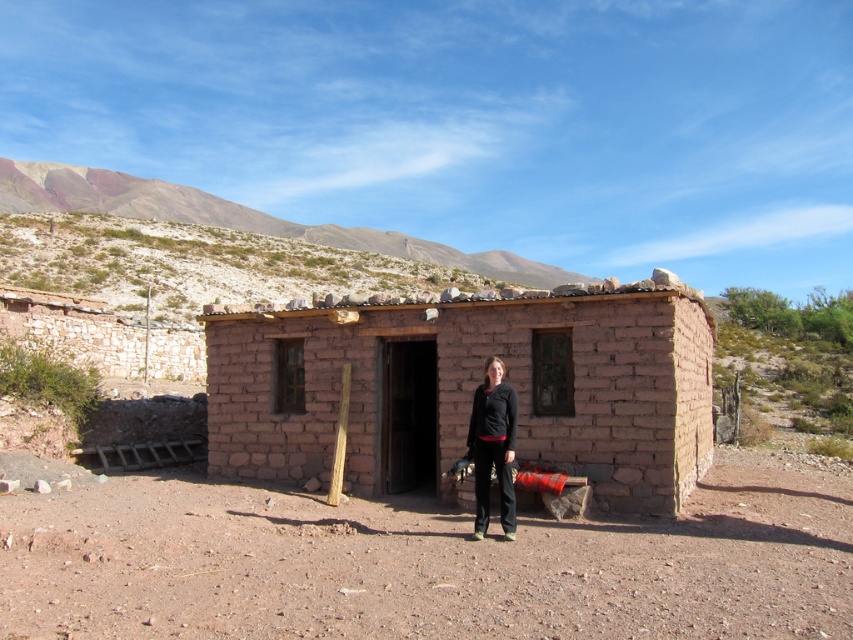
Between point (556, 396) and point (509, 480), which one is positioned in front?

Point (509, 480) is more forward.

Who is positioned more to the right, earthy adobe hut at center or black matte pants at center?

From the viewer's perspective, earthy adobe hut at center appears more on the right side.

This screenshot has height=640, width=853. Identify the location of earthy adobe hut at center. (469, 388).